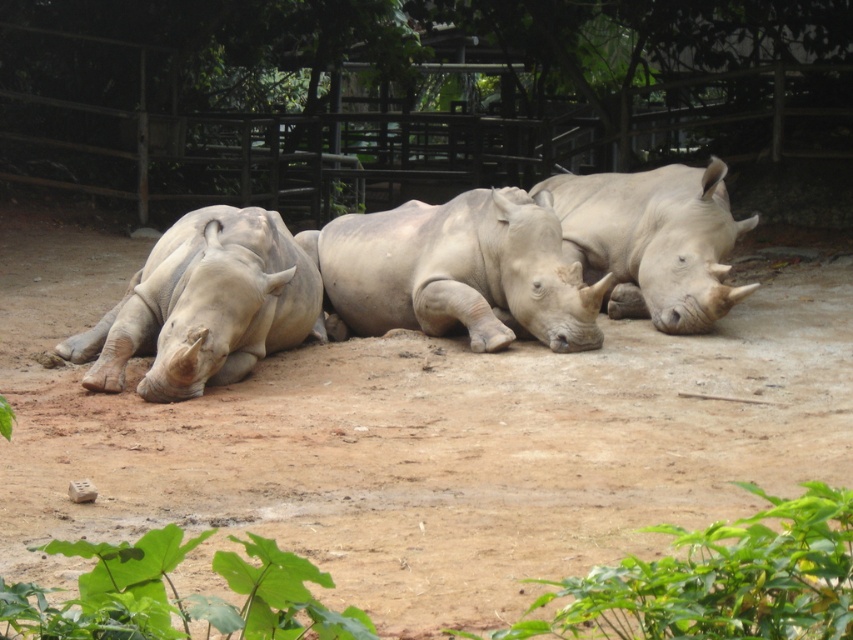
Question: Does gray matte rhinoceros at left have a larger size compared to smooth gray rhino at center?

Choices:
 (A) yes
 (B) no

Answer: (B)

Question: Which of the following is the closest to the observer?

Choices:
 (A) gray matte rhinoceros at center
 (B) smooth gray rhino at center
 (C) gray matte rhinoceros at left

Answer: (C)

Question: Is gray matte rhinoceros at center in front of gray matte rhinoceros at left?

Choices:
 (A) no
 (B) yes

Answer: (A)

Question: Which point is closer to the camera?

Choices:
 (A) click(x=705, y=332)
 (B) click(x=453, y=250)
 (C) click(x=190, y=364)

Answer: (C)

Question: Which is nearer to the smooth gray rhino at center?

Choices:
 (A) gray matte rhinoceros at left
 (B) gray matte rhinoceros at center

Answer: (B)

Question: Does gray matte rhinoceros at center have a greater width compared to gray matte rhinoceros at left?

Choices:
 (A) yes
 (B) no

Answer: (A)